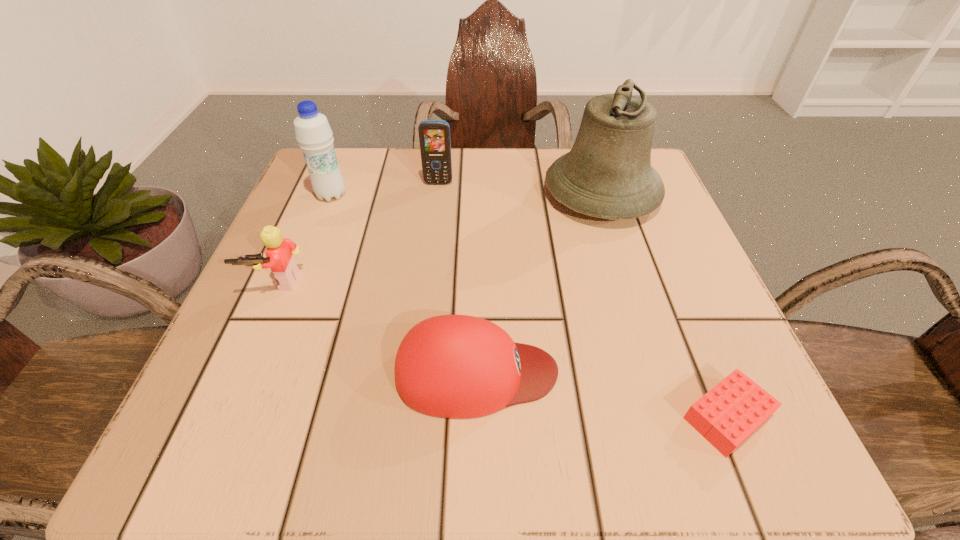
Image resolution: width=960 pixels, height=540 pixels. Identify the location of Lego present at the left edge. (279, 258).

Find the location of `bell that is positioned at the right edge`. bell that is positioned at the right edge is located at coordinates (607, 174).

Where is `Lego that is at the right edge`? The image size is (960, 540). Lego that is at the right edge is located at coordinates (730, 412).

Find the location of a particular element. The image size is (960, 540). object at the far left corner is located at coordinates (313, 133).

At what (x,y) coordinates should I click in order to perform the action: click on object located at the far right corner. Please return your answer as a coordinate pair (x, y). Looking at the image, I should click on pos(607,174).

Where is `object that is at the near right corner`? object that is at the near right corner is located at coordinates (730, 412).

In the image, there is a desktop. Identify the location of vacant space at the far edge. 406,189.

This screenshot has height=540, width=960. In the image, there is a desktop. In order to click on vacant space at the near edge in this screenshot , I will do `click(365, 430)`.

In the image, there is a desktop. Where is `vacant space at the left edge`? The height and width of the screenshot is (540, 960). vacant space at the left edge is located at coordinates (349, 226).

Locate an element on the screen. vacant space at the right edge of the desktop is located at coordinates (660, 259).